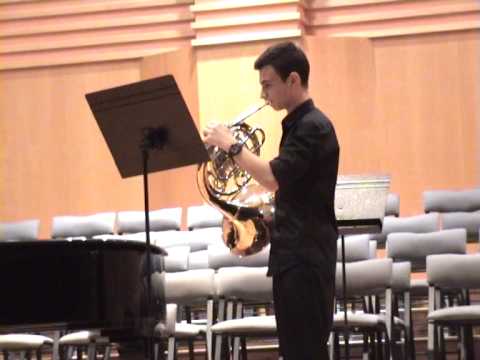
Locate an element on the screen. Image resolution: width=480 pixels, height=360 pixels. black piano is located at coordinates (94, 282).